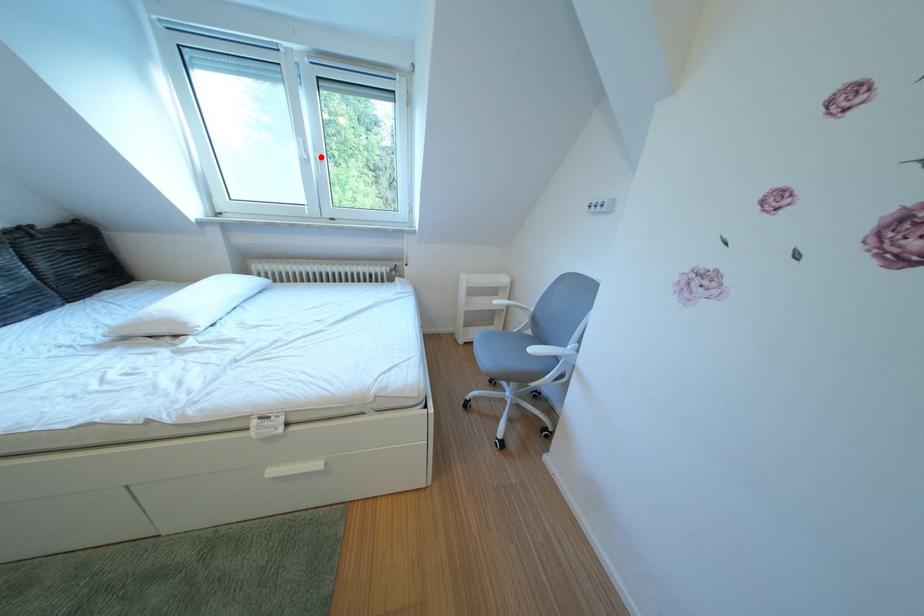
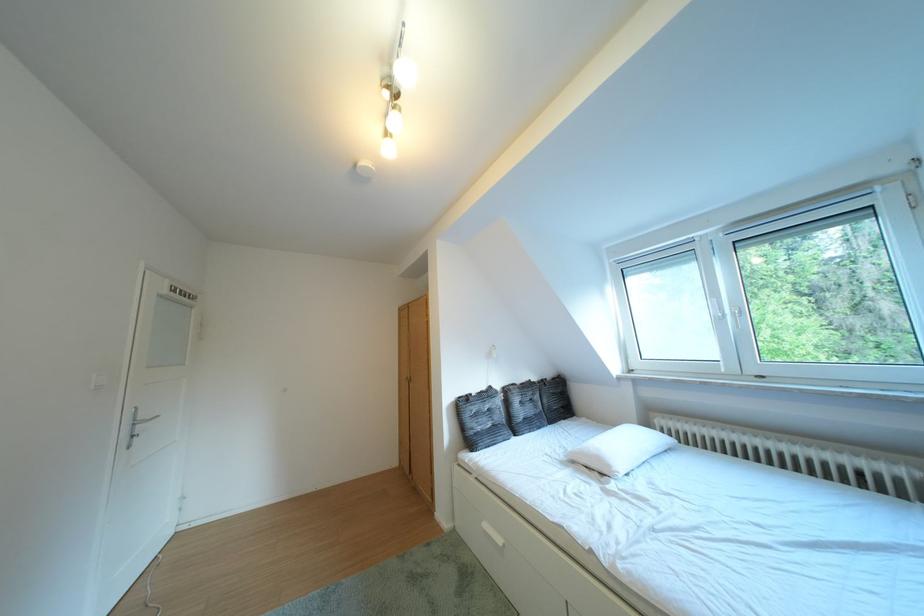
In the second image, find the point that corresponds to the highlighted location in the first image.

(736, 315)